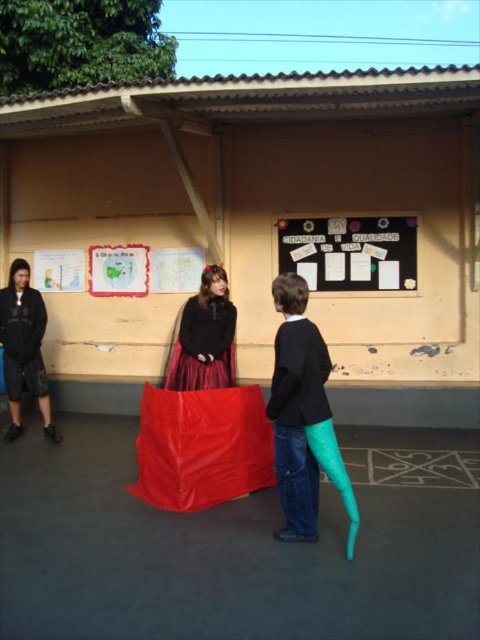
Between teal fabric tail at center and black matte bulletin board at upper center, which one has more height?

With more height is teal fabric tail at center.

Is point (312, 522) positioned behind point (402, 227)?

That is False.

Identify the location of teal fabric tail at center. This screenshot has height=640, width=480. (303, 417).

Who is taller, red tarpaulin at center or black matte jacket at left?

With more height is black matte jacket at left.

Does red tarpaulin at center appear on the left side of black matte jacket at left?

No, red tarpaulin at center is not to the left of black matte jacket at left.

Describe the element at coordinates (256, 211) in the screenshot. I see `red tarpaulin at center` at that location.

In order to click on red tarpaulin at center in this screenshot , I will do `click(256, 211)`.

Is teal fabric tail at center above black matte jacket at left?

Actually, teal fabric tail at center is below black matte jacket at left.

Who is shorter, teal fabric tail at center or black matte jacket at left?

With less height is teal fabric tail at center.

Locate an element on the screen. The image size is (480, 640). teal fabric tail at center is located at coordinates (303, 417).